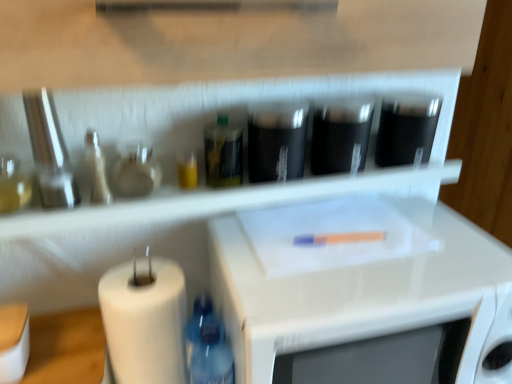
Find the location of a particular element. The height and width of the screenshot is (384, 512). white glossy microwave at center is located at coordinates (362, 294).

This screenshot has height=384, width=512. What do you see at coordinates (202, 145) in the screenshot? I see `transparent plastic shelf at upper center` at bounding box center [202, 145].

At what (x,y) coordinates should I click in order to perform the action: click on translucent glass bottle at center, which ranks as the first bottle in right-to-left order. Please return your answer as a coordinate pair (x, y). Looking at the image, I should click on (223, 153).

Describe the element at coordinates (406, 128) in the screenshot. I see `black matte container at upper right, which appears as the 1th appliance when viewed from the right` at that location.

In order to face metallic silver knife set at left, marked as the 1th appliance in a left-to-right arrangement, should I rotate leftwards or rightwards?

To face it directly, rotate left by 25.967 degrees.

Where is `white glossy microwave at center`? The width and height of the screenshot is (512, 384). white glossy microwave at center is located at coordinates (362, 294).

I want to click on the 2nd appliance counting from the left side of the white glossy microwave at center, so click(277, 141).

Is black glossy cups at center, marked as the 2th appliance in a left-to-right arrangement, to the left or to the right of white glossy microwave at center in the image?

black glossy cups at center, marked as the 2th appliance in a left-to-right arrangement, is to the left of white glossy microwave at center.

How many degrees apart are the facing directions of black glossy cups at center, marked as the 2th appliance in a left-to-right arrangement, and white glossy microwave at center?

The angle between the facing direction of black glossy cups at center, marked as the 2th appliance in a left-to-right arrangement, and the facing direction of white glossy microwave at center is 0.0688 degrees.

From the image's perspective, is black glossy cups at center, marked as the 2th appliance in a left-to-right arrangement, located above white glossy microwave at center?

Indeed, from the image's perspective, black glossy cups at center, marked as the 2th appliance in a left-to-right arrangement, is shown above white glossy microwave at center.

Is white matte paper towel at lower left to the left or to the right of black matte container at center, placed as the 2th appliance when sorted from right to left, in the image?

From the image, it's evident that white matte paper towel at lower left is to the left of black matte container at center, placed as the 2th appliance when sorted from right to left.

Which is behind, white matte paper towel at lower left or black matte container at center, placed as the 2th appliance when sorted from right to left?

black matte container at center, placed as the 2th appliance when sorted from right to left, is behind.

Is white matte paper towel at lower left positioned with its back to black matte container at center, placed as the 3th appliance when sorted from left to right?

That's not correct — white matte paper towel at lower left is not looking away from black matte container at center, placed as the 3th appliance when sorted from left to right.

Which of these two, white matte paper towel at lower left or black matte container at center, placed as the 3th appliance when sorted from left to right, is thinner?

Thinner between the two is black matte container at center, placed as the 3th appliance when sorted from left to right.

Which of these two, translucent glass bottle at center, placed as the third bottle when sorted from left to right, or transparent plastic shelf at upper center, stands taller?

translucent glass bottle at center, placed as the third bottle when sorted from left to right, is taller.

Which object is closer to the camera, translucent glass bottle at center, which ranks as the first bottle in right-to-left order, or transparent plastic shelf at upper center?

transparent plastic shelf at upper center is in front.

Considering the sizes of objects translucent glass bottle at center, marked as the first bottle in a top-to-bottom arrangement, and transparent plastic shelf at upper center in the image provided, who is wider, translucent glass bottle at center, marked as the first bottle in a top-to-bottom arrangement, or transparent plastic shelf at upper center?

With larger width is transparent plastic shelf at upper center.

Which is nearer, (233,116) or (179,266)?

Point (233,116).

Can you confirm if transparent plastic shelf at upper center is smaller than white matte paper towel at lower left?

No, transparent plastic shelf at upper center is not smaller than white matte paper towel at lower left.

Does transparent plastic shelf at upper center lie in front of white matte paper towel at lower left?

Yes, transparent plastic shelf at upper center is closer to the viewer.

Consider the image. Which object is positioned more to the left, black matte container at upper right, placed as the 4th appliance when sorted from left to right, or black glossy cups at center, arranged as the third appliance when viewed from the right?

black glossy cups at center, arranged as the third appliance when viewed from the right.

Can you confirm if black matte container at upper right, which appears as the 1th appliance when viewed from the right, is taller than black glossy cups at center, arranged as the third appliance when viewed from the right?

No.

Could you tell me if black matte container at upper right, placed as the 4th appliance when sorted from left to right, is turned towards black glossy cups at center, marked as the 2th appliance in a left-to-right arrangement?

No.

Which of these two, metallic silver knife set at left, marked as the 4th appliance in a right-to-left arrangement, or white matte paper towel at lower left, is smaller?

metallic silver knife set at left, marked as the 4th appliance in a right-to-left arrangement.

Considering the sizes of metallic silver knife set at left, marked as the 4th appliance in a right-to-left arrangement, and white matte paper towel at lower left in the image, is metallic silver knife set at left, marked as the 4th appliance in a right-to-left arrangement, taller or shorter than white matte paper towel at lower left?

Clearly, metallic silver knife set at left, marked as the 4th appliance in a right-to-left arrangement, is shorter compared to white matte paper towel at lower left.

Can you confirm if metallic silver knife set at left, marked as the 1th appliance in a left-to-right arrangement, is positioned to the right of white matte paper towel at lower left?

Incorrect, metallic silver knife set at left, marked as the 1th appliance in a left-to-right arrangement, is not on the right side of white matte paper towel at lower left.

From a real-world perspective, is metallic silver knife set at left, marked as the 4th appliance in a right-to-left arrangement, on top of white matte paper towel at lower left?

Indeed, from a real-world perspective, metallic silver knife set at left, marked as the 4th appliance in a right-to-left arrangement, stands above white matte paper towel at lower left.

Can you tell me how much metallic silver knife set at left, marked as the 4th appliance in a right-to-left arrangement, and black matte container at upper right, placed as the 4th appliance when sorted from left to right, differ in facing direction?

4.7 degrees separate the facing orientations of metallic silver knife set at left, marked as the 4th appliance in a right-to-left arrangement, and black matte container at upper right, placed as the 4th appliance when sorted from left to right.

Choose the correct answer: Is metallic silver knife set at left, marked as the 1th appliance in a left-to-right arrangement, inside black matte container at upper right, which appears as the 1th appliance when viewed from the right, or outside it?

metallic silver knife set at left, marked as the 1th appliance in a left-to-right arrangement, is located beyond the bounds of black matte container at upper right, which appears as the 1th appliance when viewed from the right.

Is metallic silver knife set at left, marked as the 4th appliance in a right-to-left arrangement, in front of or behind black matte container at upper right, which appears as the 1th appliance when viewed from the right, in the image?

In the image, metallic silver knife set at left, marked as the 4th appliance in a right-to-left arrangement, appears in front of black matte container at upper right, which appears as the 1th appliance when viewed from the right.

From the picture: Can you confirm if metallic silver knife set at left, marked as the 4th appliance in a right-to-left arrangement, is taller than black matte container at upper right, placed as the 4th appliance when sorted from left to right?

Yes, metallic silver knife set at left, marked as the 4th appliance in a right-to-left arrangement, is taller than black matte container at upper right, placed as the 4th appliance when sorted from left to right.

From a real-world perspective, count 2nd appliances upward from the white glossy microwave at center and point to it. Please provide its 2D coordinates.

[(277, 141)]

The height and width of the screenshot is (384, 512). What are the coordinates of `the 2nd appliance counting from the right of the white matte paper towel at lower left` in the screenshot? It's located at (341, 135).

From the image, which object appears to be nearer to blue plastic bottle at lower left, the second bottle in the left-to-right sequence, metallic silver knife set at left, marked as the 4th appliance in a right-to-left arrangement, or translucent glass bottle at center, the 3th bottle ordered from the bottom?

Among the two, translucent glass bottle at center, the 3th bottle ordered from the bottom, is located nearer to blue plastic bottle at lower left, the second bottle in the left-to-right sequence.

Estimate the real-world distances between objects in this image. Which object is further from white glossy microwave at center, translucent glass bottle at left, marked as the third bottle in a right-to-left arrangement, or black glossy cups at center, marked as the 2th appliance in a left-to-right arrangement?

The object further to white glossy microwave at center is translucent glass bottle at left, marked as the third bottle in a right-to-left arrangement.

Estimate the real-world distances between objects in this image. Which object is further from white matte paper towel at lower left, black matte container at center, placed as the 3th appliance when sorted from left to right, or metallic silver knife set at left, marked as the 1th appliance in a left-to-right arrangement?

black matte container at center, placed as the 3th appliance when sorted from left to right.

Looking at the image, which one is located further to translucent glass bottle at center, placed as the third bottle when sorted from left to right, black matte container at center, placed as the 2th appliance when sorted from right to left, or metallic silver knife set at left, marked as the 1th appliance in a left-to-right arrangement?

metallic silver knife set at left, marked as the 1th appliance in a left-to-right arrangement.

Based on their spatial positions, is white matte paper towel at lower left or translucent glass bottle at left, marked as the third bottle in a right-to-left arrangement, further from black matte container at center, placed as the 2th appliance when sorted from right to left?

translucent glass bottle at left, marked as the third bottle in a right-to-left arrangement, is further to black matte container at center, placed as the 2th appliance when sorted from right to left.

Estimate the real-world distances between objects in this image. Which object is further from transparent plastic shelf at upper center, translucent glass bottle at center, marked as the first bottle in a top-to-bottom arrangement, or white glossy microwave at center?

white glossy microwave at center is positioned further to the anchor transparent plastic shelf at upper center.

Estimate the real-world distances between objects in this image. Which object is closer to blue plastic bottle at lower left, positioned as the first bottle in bottom-to-top order, white matte paper towel at lower left or black matte container at upper right, placed as the 4th appliance when sorted from left to right?

white matte paper towel at lower left is closer to blue plastic bottle at lower left, positioned as the first bottle in bottom-to-top order.

From the image, which object appears to be farther from white glossy microwave at center, translucent glass bottle at center, marked as the first bottle in a top-to-bottom arrangement, or black glossy cups at center, arranged as the third appliance when viewed from the right?

translucent glass bottle at center, marked as the first bottle in a top-to-bottom arrangement, is further to white glossy microwave at center.

Locate an element on the screen. paper towel between translucent glass bottle at left, arranged as the 2th bottle when viewed from the top, and black matte container at center, placed as the 2th appliance when sorted from right to left, from left to right is located at coordinates (144, 321).

I want to click on paper towel between translucent glass bottle at left, arranged as the 2th bottle when viewed from the top, and white glossy microwave at center, in the horizontal direction, so click(144, 321).

This screenshot has width=512, height=384. What are the coordinates of `shelf between metallic silver knife set at left, marked as the 4th appliance in a right-to-left arrangement, and black glossy cups at center, arranged as the third appliance when viewed from the right` in the screenshot? It's located at (202, 145).

At what (x,y) coordinates should I click in order to perform the action: click on microwave between black glossy cups at center, arranged as the third appliance when viewed from the right, and white matte paper towel at lower left from top to bottom. Please return your answer as a coordinate pair (x, y). Image resolution: width=512 pixels, height=384 pixels. Looking at the image, I should click on (362, 294).